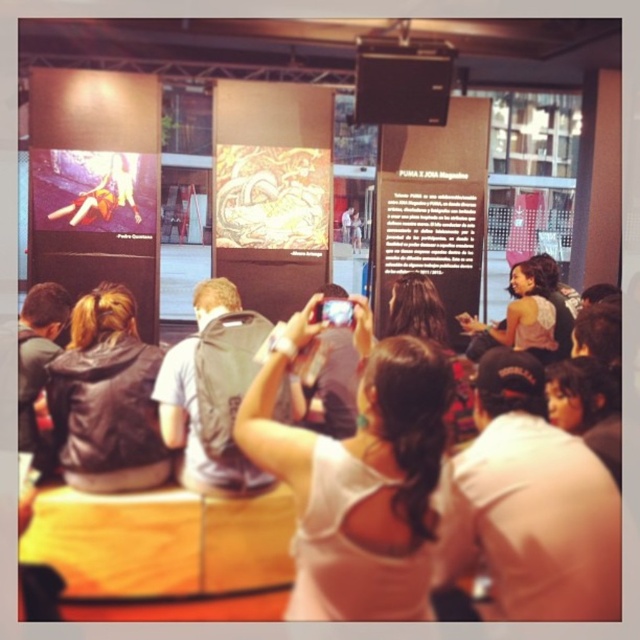
Is white fabric at center bigger than white fabric crowd at center?

Correct, white fabric at center is larger in size than white fabric crowd at center.

Is point (346, 509) positioned behind point (220, 566)?

No, (346, 509) is in front of (220, 566).

Between point (428, 593) and point (140, 545), which one is positioned in front?

Point (428, 593)

You are a GUI agent. You are given a task and a screenshot of the screen. Output one action in this format:
    pyautogui.click(x=<x>, y=<y>)
    Task: Click on the white fabric at center
    
    Given the screenshot: What is the action you would take?
    pyautogui.click(x=358, y=480)